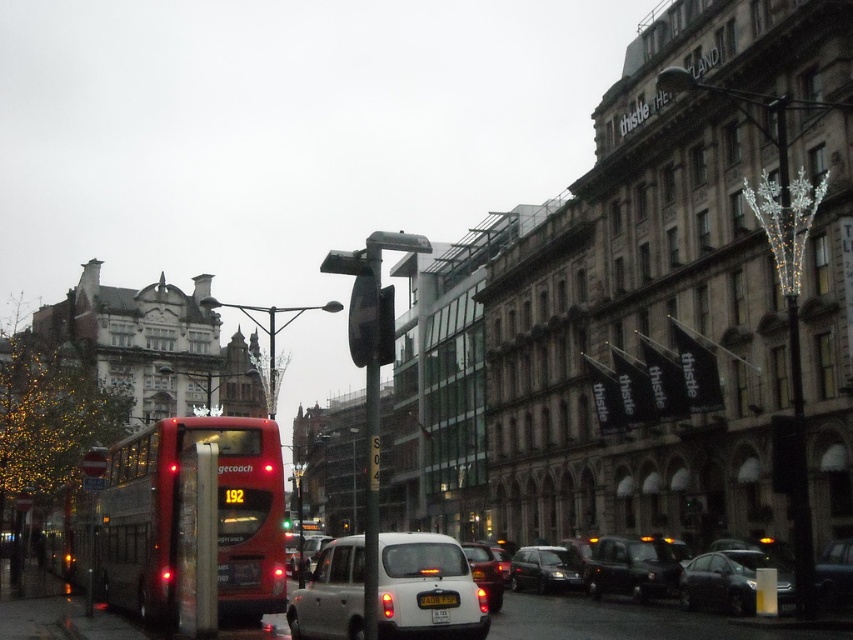
Can you confirm if shiny black sedan at center is positioned above white plastic license plate at center?

Actually, shiny black sedan at center is below white plastic license plate at center.

Between shiny black sedan at center and white plastic license plate at center, which one appears on the right side from the viewer's perspective?

Positioned to the right is shiny black sedan at center.

Is point (552, 556) more distant than point (425, 596)?

Yes, point (552, 556) is farther from viewer.

Where is `shiny black sedan at center`? The width and height of the screenshot is (853, 640). shiny black sedan at center is located at coordinates (543, 570).

Consider the image. Is black matte taxi at center closer to the viewer compared to matte white car at center?

No, black matte taxi at center is further to the viewer.

Can you confirm if black matte taxi at center is positioned above matte white car at center?

Incorrect, black matte taxi at center is not positioned above matte white car at center.

Where is `black matte taxi at center`? Image resolution: width=853 pixels, height=640 pixels. black matte taxi at center is located at coordinates (631, 566).

You are a GUI agent. You are given a task and a screenshot of the screen. Output one action in this format:
    pyautogui.click(x=<x>, y=<y>)
    Task: Click on the black matte taxi at center
    Image resolution: width=853 pixels, height=640 pixels.
    Given the screenshot: What is the action you would take?
    pyautogui.click(x=631, y=566)

Is white plastic license plate at center wider than yellow matte license plate at center?

Yes, white plastic license plate at center is wider than yellow matte license plate at center.

Measure the distance between white plastic license plate at center and yellow matte license plate at center.

A distance of 18.35 inches exists between white plastic license plate at center and yellow matte license plate at center.

What do you see at coordinates (437, 598) in the screenshot? This screenshot has width=853, height=640. I see `white plastic license plate at center` at bounding box center [437, 598].

Locate an element on the screen. The image size is (853, 640). white plastic license plate at center is located at coordinates [437, 598].